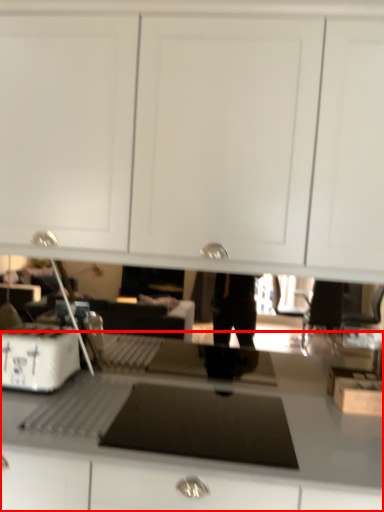
Question: In this image, where is countertop (annotated by the red box) located relative to home appliance?

Choices:
 (A) right
 (B) left

Answer: (A)